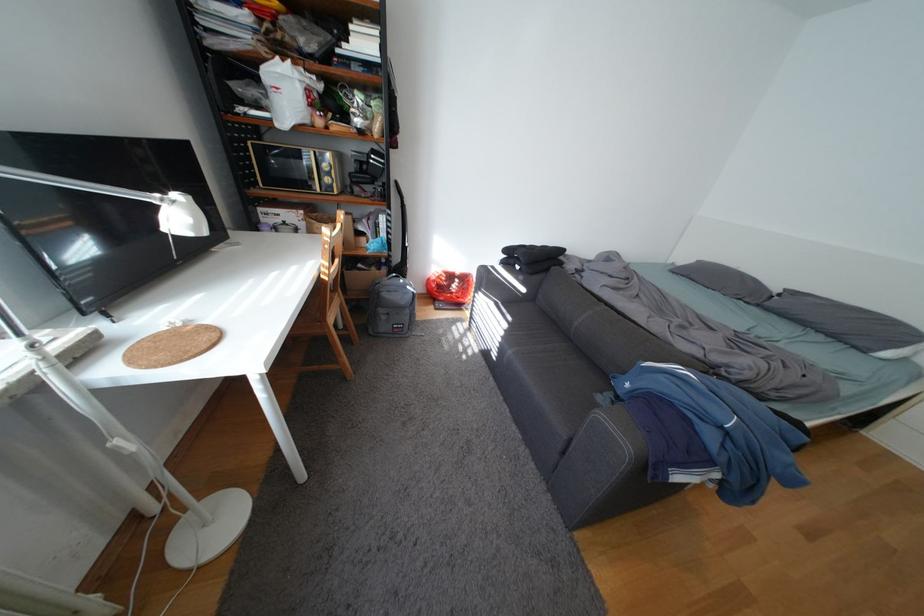
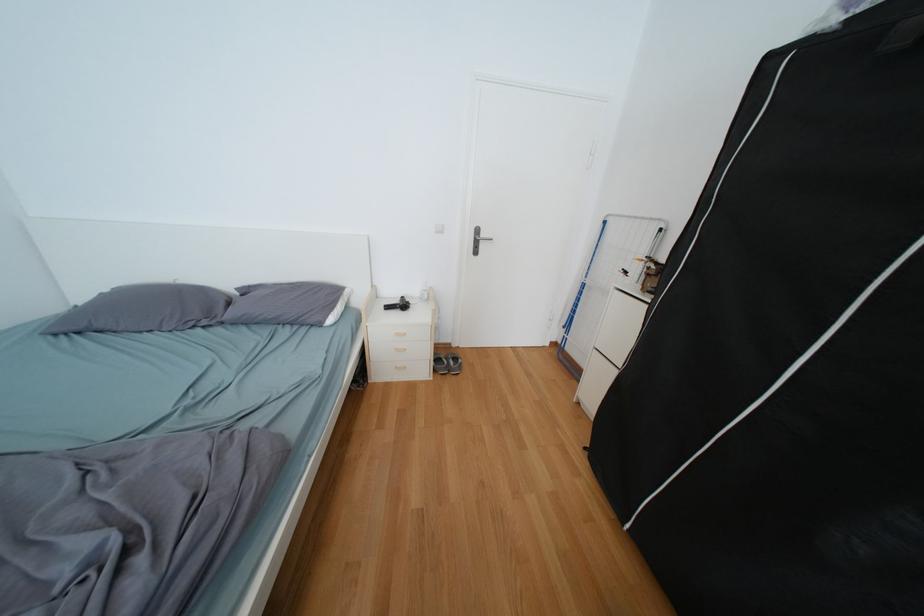
Find the pixel in the second image that matches (x=772, y=306) in the first image.

(235, 323)